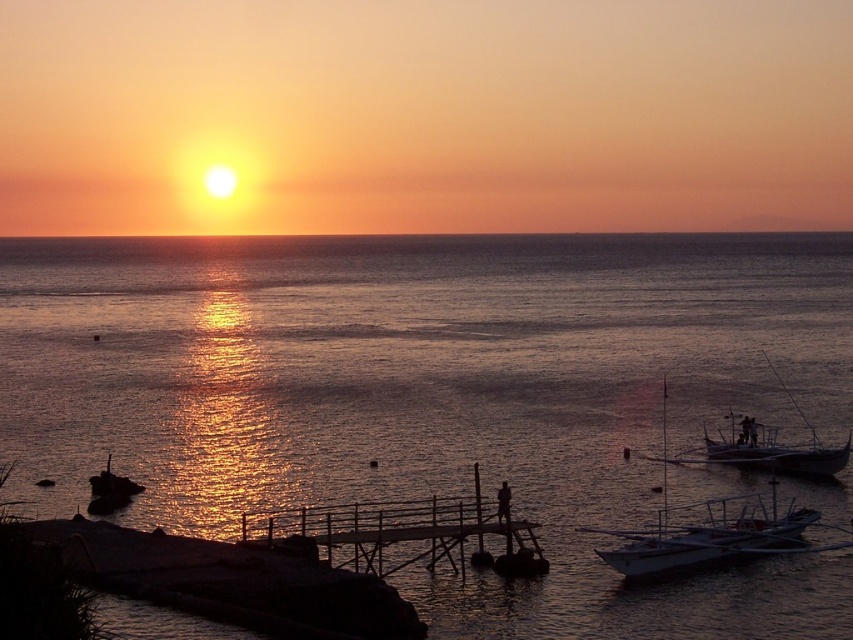
Does glistening water at center have a lesser width compared to white glossy boat at lower right?

No, glistening water at center is not thinner than white glossy boat at lower right.

Looking at this image, between glistening water at center and white glossy boat at lower right, which one appears on the right side from the viewer's perspective?

From the viewer's perspective, white glossy boat at lower right appears more on the right side.

Does point (97, 394) come farther from viewer compared to point (804, 550)?

Yes, point (97, 394) is farther from viewer.

The width and height of the screenshot is (853, 640). I want to click on glistening water at center, so (x=433, y=396).

Is glistening water at center taller than wooden dock at center?

Yes, glistening water at center is taller than wooden dock at center.

Does glistening water at center appear on the right side of wooden dock at center?

Indeed, glistening water at center is positioned on the right side of wooden dock at center.

Describe the element at coordinates (433, 396) in the screenshot. I see `glistening water at center` at that location.

Find the location of a particular element. The image size is (853, 640). glistening water at center is located at coordinates (433, 396).

Is glistening water at center positioned at the back of white matte boat at lower right?

No, glistening water at center is closer to the viewer.

Describe the element at coordinates (433, 396) in the screenshot. I see `glistening water at center` at that location.

Locate an element on the screen. glistening water at center is located at coordinates (433, 396).